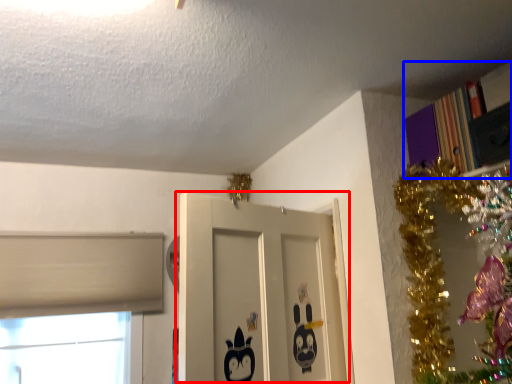
Question: Among these objects, which one is farthest to the camera, door (highlighted by a red box) or bookcase (highlighted by a blue box)?

Choices:
 (A) door
 (B) bookcase

Answer: (B)